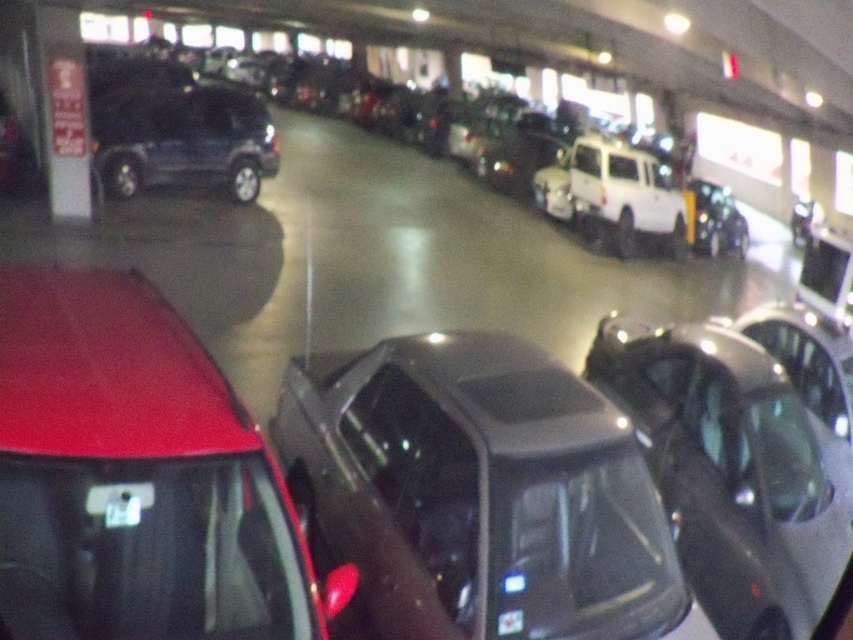
Question: Is matte black car at center in front of shiny black car at center?

Choices:
 (A) yes
 (B) no

Answer: (A)

Question: Considering the real-world distances, which object is closest to the shiny red car at lower left?

Choices:
 (A) matte black suv at center
 (B) shiny black car at center
 (C) matte black car at center

Answer: (C)

Question: Which point is farther from the camera taking this photo?

Choices:
 (A) (809, 573)
 (B) (219, 156)
 (C) (178, 625)
 (D) (561, 426)

Answer: (B)

Question: Does matte black car at center have a greater width compared to matte black suv at center?

Choices:
 (A) yes
 (B) no

Answer: (A)

Question: Which object is closer to the camera taking this photo?

Choices:
 (A) shiny red car at lower left
 (B) matte black suv at center
 (C) shiny black car at center
 (D) matte black car at center

Answer: (A)

Question: Is matte black car at center thinner than shiny red car at lower left?

Choices:
 (A) yes
 (B) no

Answer: (B)